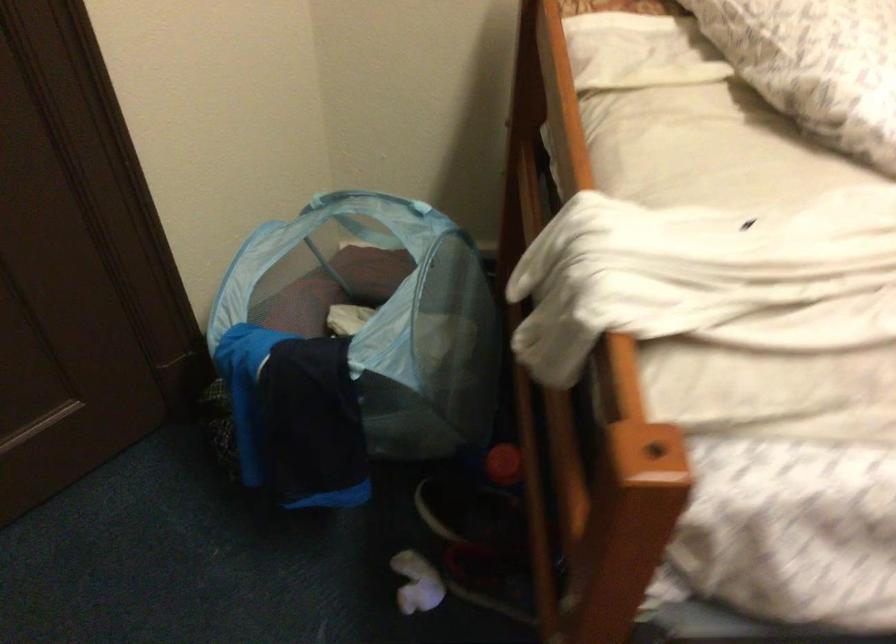
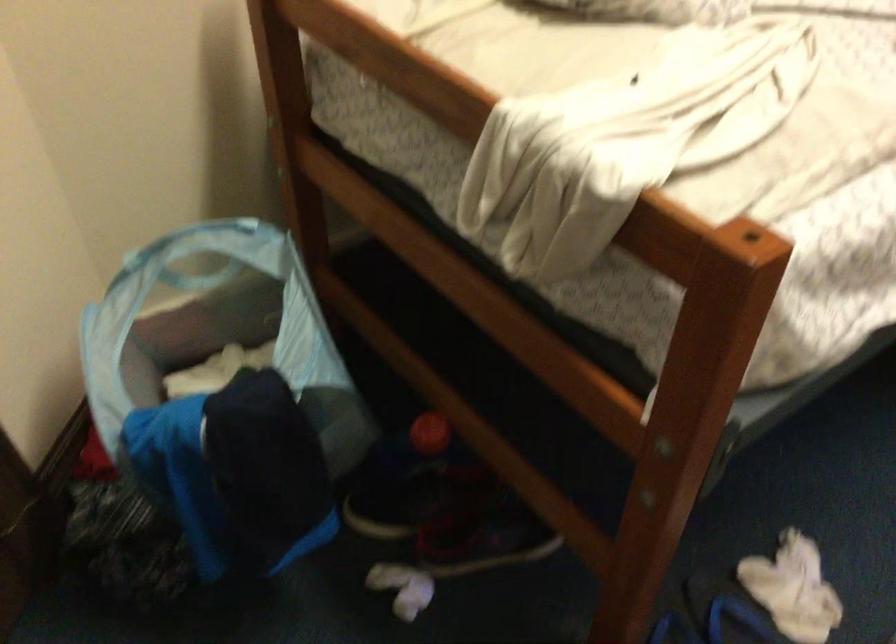
Question: The camera is either moving clockwise (left) or counter-clockwise (right) around the object. The first image is from the beginning of the video and the second image is from the end. Is the camera moving left or right when shooting the video?

Choices:
 (A) Left
 (B) Right

Answer: (A)